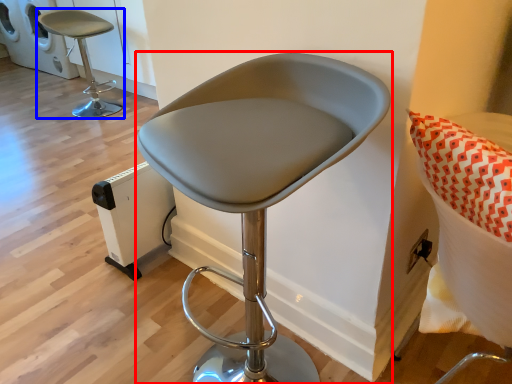
Question: Which object is closer to the camera taking this photo, chair (highlighted by a red box) or chair (highlighted by a blue box)?

Choices:
 (A) chair
 (B) chair

Answer: (A)